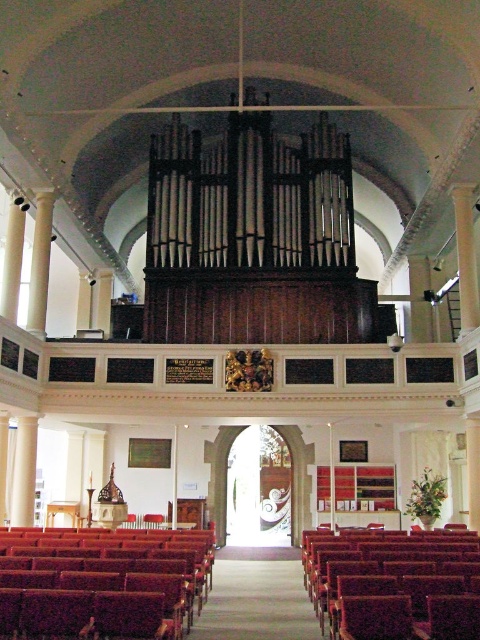
Can you confirm if smooth wood bench at lower left is positioned below velvet burgundy bench at lower right?

No, smooth wood bench at lower left is not below velvet burgundy bench at lower right.

The width and height of the screenshot is (480, 640). What do you see at coordinates (103, 582) in the screenshot?
I see `smooth wood bench at lower left` at bounding box center [103, 582].

Is point (85, 625) farther from camera compared to point (385, 588)?

No, it is not.

Locate an element on the screen. The height and width of the screenshot is (640, 480). smooth wood bench at lower left is located at coordinates (103, 582).